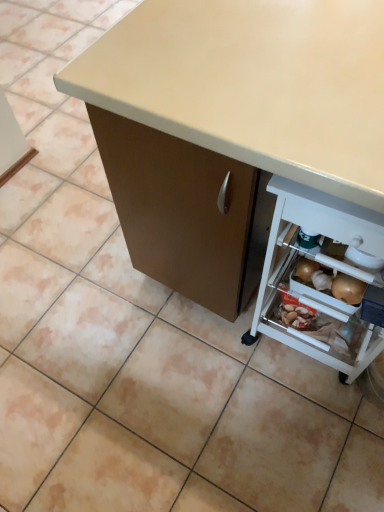
This screenshot has width=384, height=512. Identify the location of free location to the left of white plastic shelf at lower right. (207, 358).